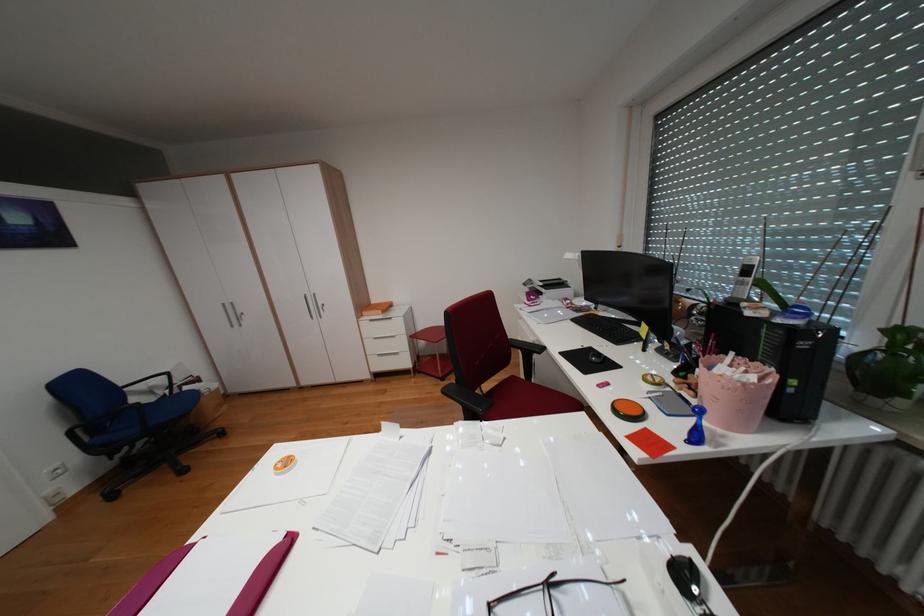
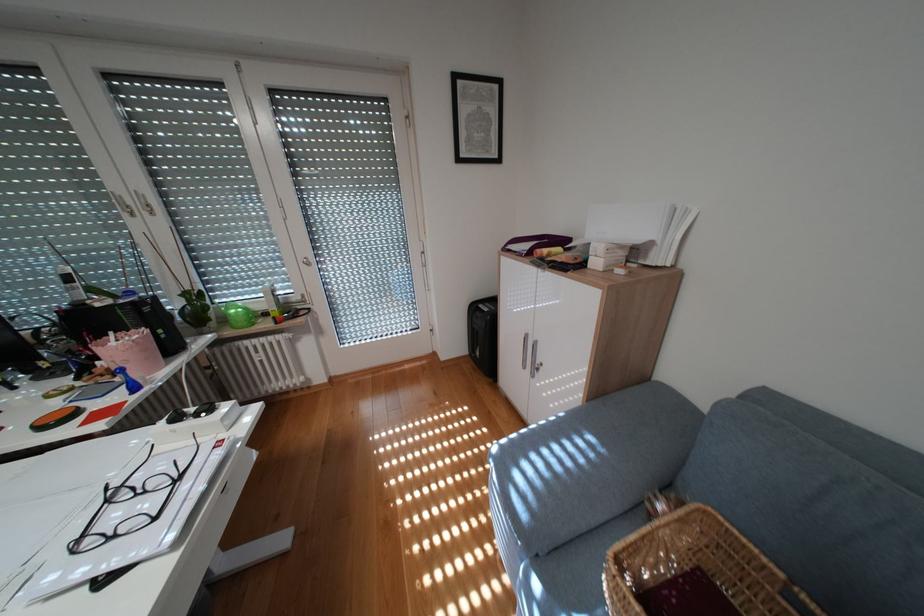
The first image is from the beginning of the video and the second image is from the end. How did the camera likely rotate when shooting the video?

The camera rotated toward right-down.